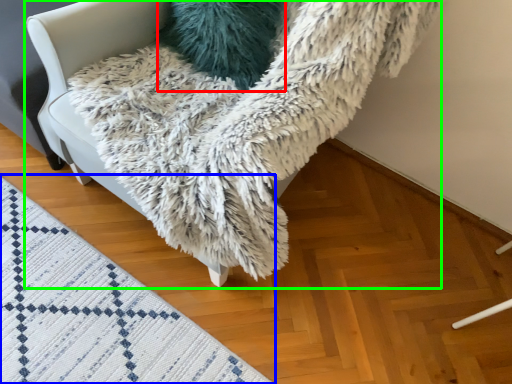
Question: Which object is positioned farthest from pillow (highlighted by a red box)? Select from mat (highlighted by a blue box) and furniture (highlighted by a green box).

Choices:
 (A) mat
 (B) furniture

Answer: (A)